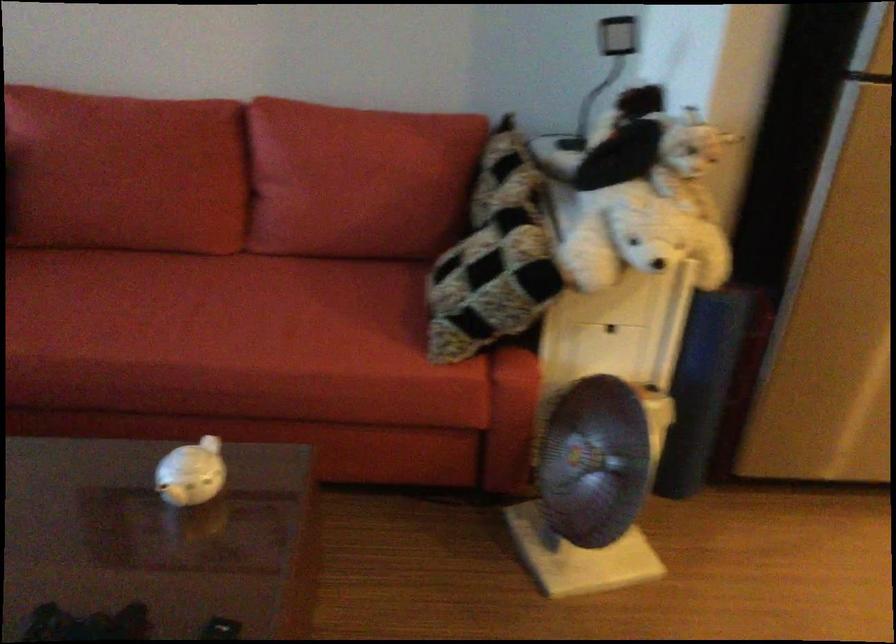
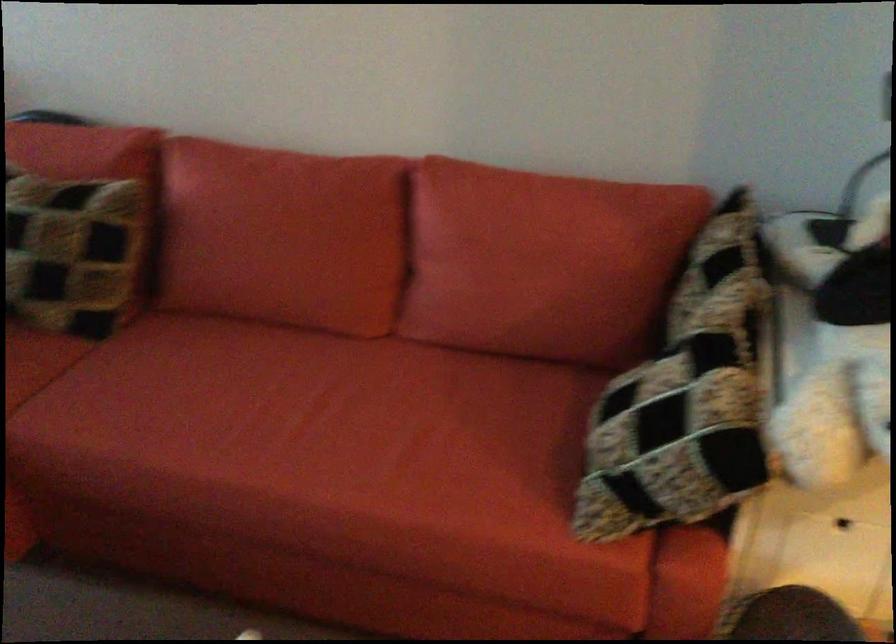
Question: The images are taken continuously from a first-person perspective. In which direction are you moving?

Choices:
 (A) Left
 (B) Right
 (C) Forward
 (D) Backward

Answer: (C)